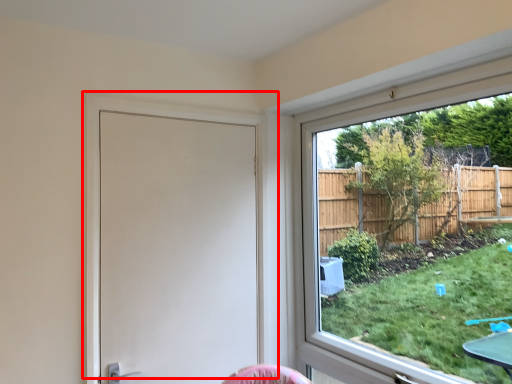
Question: Observing the image, what is the correct spatial positioning of door (annotated by the red box) in reference to window?

Choices:
 (A) right
 (B) left

Answer: (B)